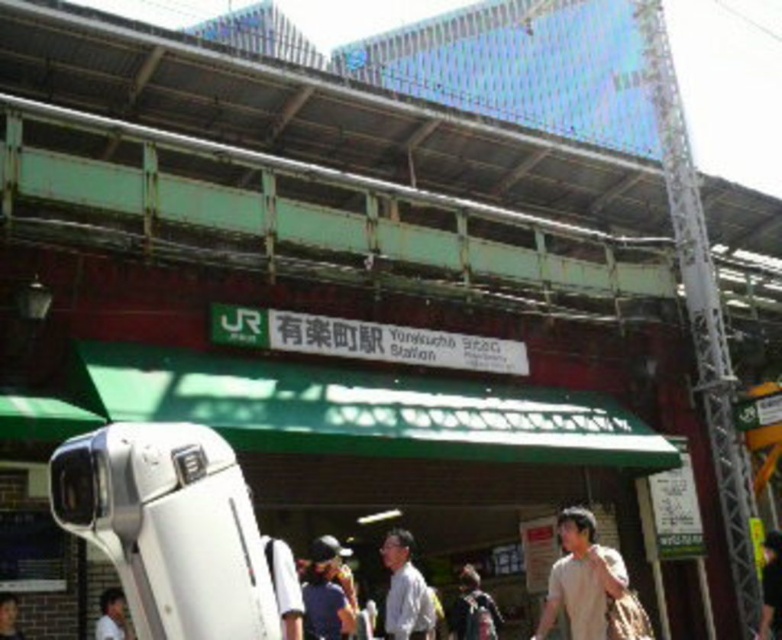
Question: Which point is farther to the camera?

Choices:
 (A) light brown hair at lower right
 (B) blue fabric shirt at lower center

Answer: (A)

Question: Does dark brown backpack at center appear on the left side of light brown hair at lower right?

Choices:
 (A) no
 (B) yes

Answer: (B)

Question: Is blue fabric shirt at lower center to the left of dark brown backpack at center from the viewer's perspective?

Choices:
 (A) no
 (B) yes

Answer: (B)

Question: Which of the following is the farthest from the observer?

Choices:
 (A) white matte shirt at center
 (B) light brown hair at lower right
 (C) blue fabric shirt at lower center
 (D) light brown hair at lower left

Answer: (B)

Question: Is white matte shirt at center below light brown hair at lower left?

Choices:
 (A) no
 (B) yes

Answer: (B)

Question: Which of these objects is positioned closest to the blue fabric shirt at lower center?

Choices:
 (A) light brown cotton shirt at lower right
 (B) white matte shirt at center

Answer: (B)